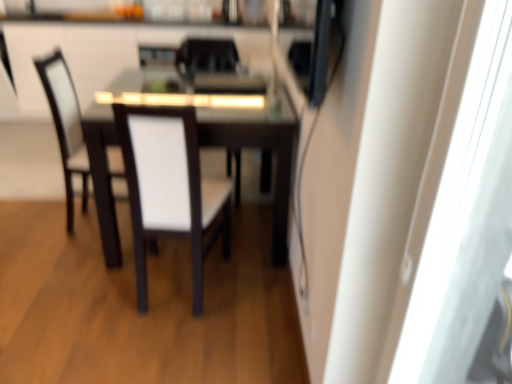
Image resolution: width=512 pixels, height=384 pixels. Identify the location of vacant area to the left of white fabric chair at center, the fourth chair from the back. (82, 286).